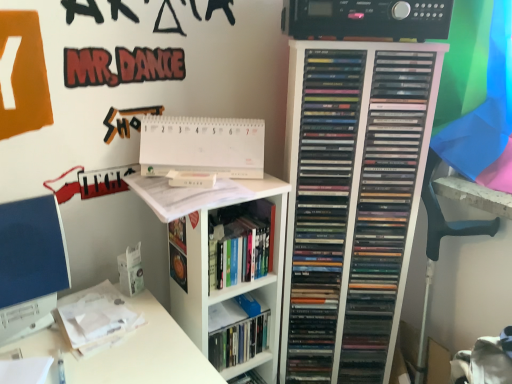
Question: Based on their sizes in the image, would you say hardcover book at center is bigger or smaller than white glossy bookshelf at upper center?

Choices:
 (A) small
 (B) big

Answer: (A)

Question: Considering the positions of hardcover book at center and white glossy bookshelf at upper center in the image, is hardcover book at center taller or shorter than white glossy bookshelf at upper center?

Choices:
 (A) short
 (B) tall

Answer: (A)

Question: Which object is positioned closest to the white paper at upper center, the 1th paperback book when ordered from top to bottom?

Choices:
 (A) blue matte computer monitor at left
 (B) black plastic stereo at upper center
 (C) hardcover book at center
 (D) black plastic swivel chair at right
 (E) white matte paperback book at center, which is the 1th paperback book from bottom to top

Answer: (E)

Question: Which object is the closest to the white paper at upper center, the 1th paperback book when ordered from top to bottom?

Choices:
 (A) black plastic swivel chair at right
 (B) blue matte computer monitor at left
 (C) black plastic stereo at upper center
 (D) white glossy bookshelf at upper center
 (E) white matte paperback book at center, which is the second paperback book from top to bottom

Answer: (E)